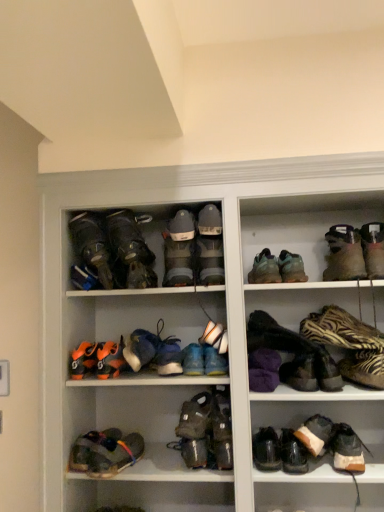
Question: Considering the positions of orange mesh sneaker at lower center, which is counted as the 17th footwear, starting from the right, and leather hiking boots at upper left, which is counted as the 18th footwear, starting from the right, in the image, is orange mesh sneaker at lower center, which is counted as the 17th footwear, starting from the right, wider or thinner than leather hiking boots at upper left, which is counted as the 18th footwear, starting from the right,?

Choices:
 (A) wide
 (B) thin

Answer: (A)

Question: Would you say orange mesh sneaker at lower center, which is counted as the 17th footwear, starting from the right, is to the left or to the right of leather hiking boots at upper left, which is counted as the 18th footwear, starting from the right, in the picture?

Choices:
 (A) left
 (B) right

Answer: (B)

Question: Which object is positioned closest to the blue suede sneaker at center?

Choices:
 (A) purple fuzzy slippers at center, the fourteenth footwear when ordered from left to right
 (B) multicolored fabric sandal at lower left, acting as the fifth footwear starting from the left
 (C) white fabric shoe at center, the tenth footwear positioned from the right
 (D) camouflage fabric boot at center, which ranks as the 8th footwear in right-to-left order
 (E) leather hiking boots at upper left, the 3th footwear positioned from the left

Answer: (C)

Question: Estimate the real-world distances between objects in this image. Which object is closer to the multicolored fabric sandal at lower left, marked as the sixteenth footwear in a right-to-left arrangement?

Choices:
 (A) leather/textured shoe at lower right, the 18th footwear from the left
 (B) brown suede boots at upper right, which is the 19th footwear in left-to-right order
 (C) blue suede shoe at center, which is counted as the 13th footwear, starting from the right
 (D) orange mesh sneaker at lower center, the fourth footwear positioned from the left
 (E) white fabric shoe at center, the eleventh footwear when ordered from left to right

Answer: (D)